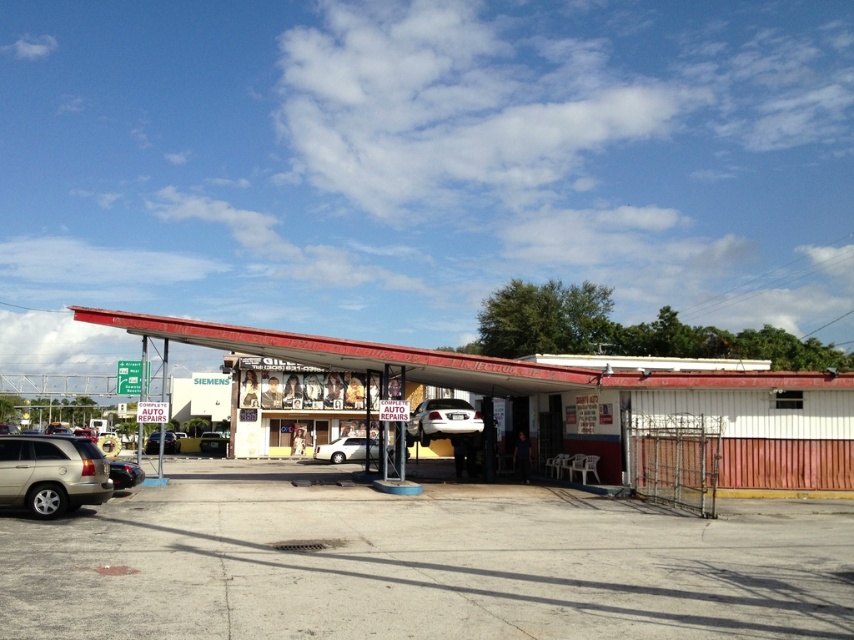
You are a customer arriving at the Complete Auto Repairs shop and need to park your car. You see the red corrugated metal awning at center and the white glossy car at center. Which object should you avoid driving over to park your vehicle?

You should avoid driving over the red corrugated metal awning at center because it is in front of the white glossy car at center, meaning the awning is closer to you and could be obstructing the parking space.

Based on the photo, you are standing in front of the auto repair shop and want to locate two specific points marked on the image. Which of the two points, point [85,317] or point [447,410], is closer to you?

Point [85,317] is closer to the viewer than point [447,410].

You are a customer who just arrived at the Complete Auto Repairs shop and want to park your car. There are two cars in the parking lot at center. The white matte sedan at center and the matte black car at center. Which one is more to the right side?

The white matte sedan at center is positioned on the right side of matte black car at center.